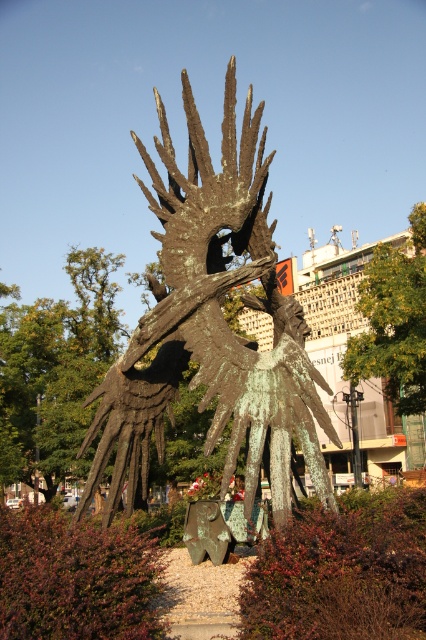
Is point (103, 449) positioned in front of point (71, 531)?

That is False.

Does green patina metal sculpture at center have a lesser height compared to green patina sculpture at center?

No.

Between point (250, 177) and point (26, 588), which one is positioned behind?

Positioned behind is point (250, 177).

The height and width of the screenshot is (640, 426). In order to click on green patina metal sculpture at center in this screenshot , I will do `click(212, 324)`.